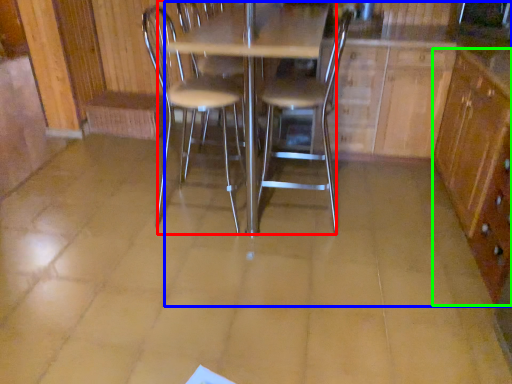
Question: Estimate the real-world distances between objects in this image. Which object is farther from table (highlighted by a red box), dresser (highlighted by a blue box) or file cabinet (highlighted by a green box)?

Choices:
 (A) dresser
 (B) file cabinet

Answer: (B)